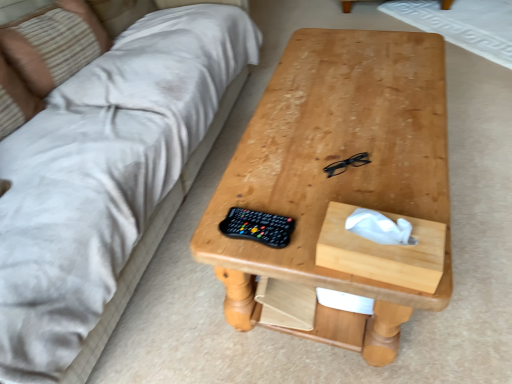
Question: Is beige fabric couch at upper left wider than wooden tissue box at center-right?

Choices:
 (A) yes
 (B) no

Answer: (A)

Question: Can you confirm if beige fabric couch at upper left is smaller than wooden tissue box at center-right?

Choices:
 (A) yes
 (B) no

Answer: (B)

Question: Is beige fabric couch at upper left to the right of wooden tissue box at center-right from the viewer's perspective?

Choices:
 (A) no
 (B) yes

Answer: (A)

Question: Is beige fabric couch at upper left facing away from wooden tissue box at center-right?

Choices:
 (A) yes
 (B) no

Answer: (B)

Question: Is beige fabric couch at upper left taller than wooden tissue box at center-right?

Choices:
 (A) no
 (B) yes

Answer: (A)

Question: Can you confirm if beige fabric couch at upper left is shorter than wooden tissue box at center-right?

Choices:
 (A) yes
 (B) no

Answer: (A)

Question: From the image's perspective, is natural wood table at center on top of wooden tissue box at center-right?

Choices:
 (A) yes
 (B) no

Answer: (A)

Question: Is natural wood table at center aimed at wooden tissue box at center-right?

Choices:
 (A) yes
 (B) no

Answer: (B)

Question: Can you confirm if natural wood table at center is taller than wooden tissue box at center-right?

Choices:
 (A) yes
 (B) no

Answer: (A)

Question: Is the position of natural wood table at center less distant than that of wooden tissue box at center-right?

Choices:
 (A) yes
 (B) no

Answer: (B)

Question: From a real-world perspective, is natural wood table at center below wooden tissue box at center-right?

Choices:
 (A) no
 (B) yes

Answer: (B)

Question: Is natural wood table at center beside wooden tissue box at center-right?

Choices:
 (A) yes
 (B) no

Answer: (B)

Question: Considering the relative sizes of beige striped pillow at upper left and black plastic glasses at center in the image provided, is beige striped pillow at upper left shorter than black plastic glasses at center?

Choices:
 (A) no
 (B) yes

Answer: (A)